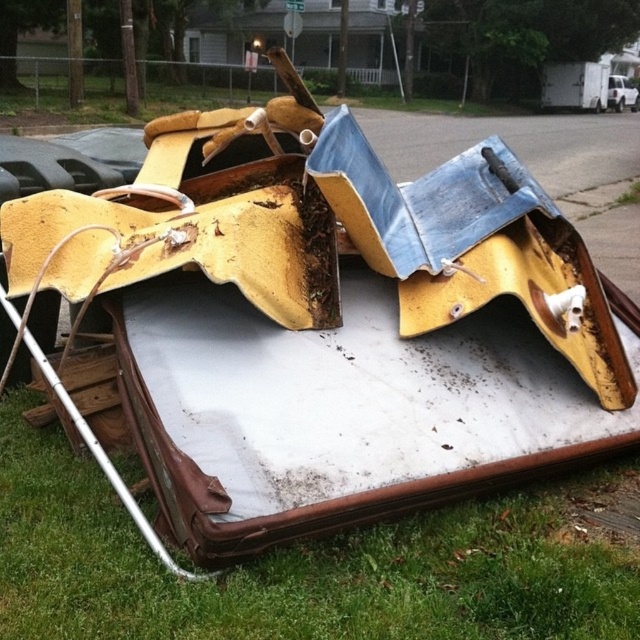
Can you confirm if green grass at lower left is shorter than white matte truck at upper right?

Indeed, green grass at lower left has a lesser height compared to white matte truck at upper right.

Does green grass at lower left have a greater width compared to white matte truck at upper right?

Correct, the width of green grass at lower left exceeds that of white matte truck at upper right.

Between point (49, 518) and point (634, 84), which one is positioned in front?

Point (49, 518)

Find the location of `green grass at lower left`. green grass at lower left is located at coordinates (301, 564).